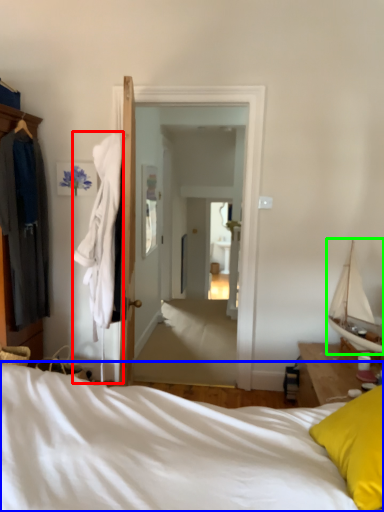
Question: Estimate the real-world distances between objects in this image. Which object is farther from clothing (highlighted by a red box), bed (highlighted by a blue box) or boat (highlighted by a green box)?

Choices:
 (A) bed
 (B) boat

Answer: (B)